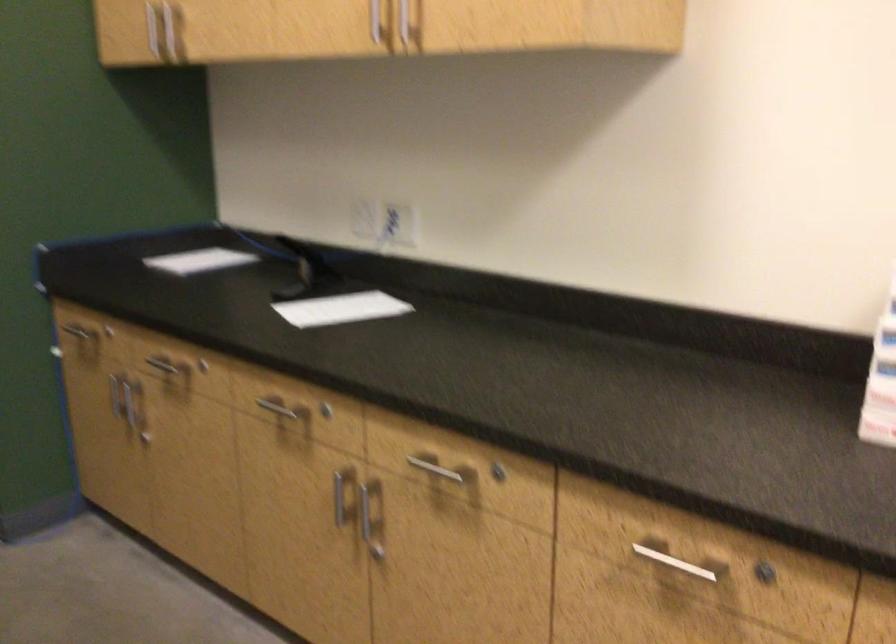
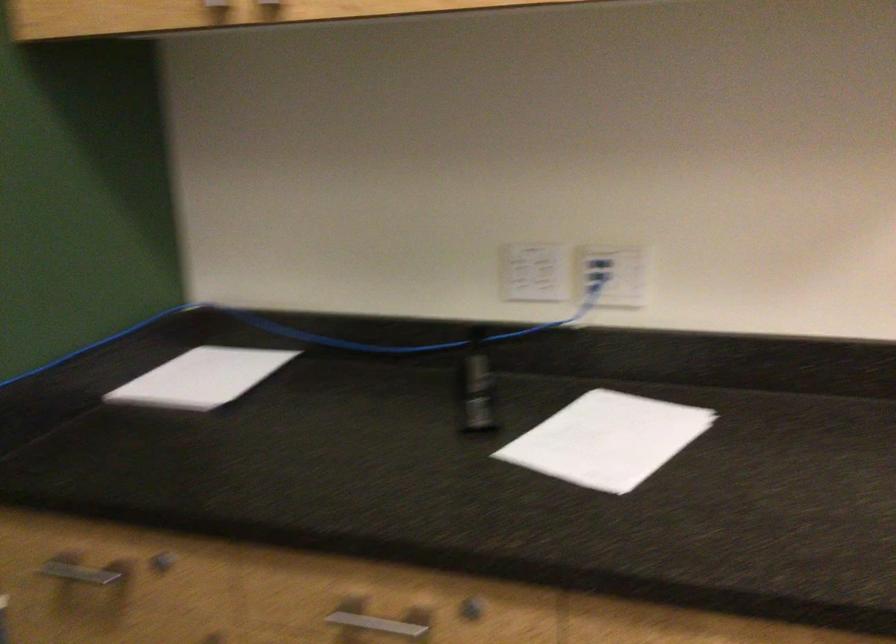
Which direction would the cameraman need to move to produce the second image?

The cameraman walked toward left, forward.